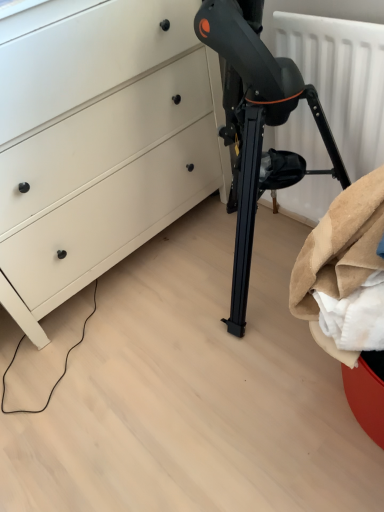
Describe the element at coordinates (100, 145) in the screenshot. This screenshot has width=384, height=512. I see `white matte chest of drawers at lower left` at that location.

The height and width of the screenshot is (512, 384). In order to click on white matte chest of drawers at lower left in this screenshot , I will do click(100, 145).

Where is `white matte radiator at upper right`? white matte radiator at upper right is located at coordinates (341, 79).

What do you see at coordinates (341, 79) in the screenshot? The height and width of the screenshot is (512, 384). I see `white matte radiator at upper right` at bounding box center [341, 79].

Locate an element on the screen. white matte chest of drawers at lower left is located at coordinates (x=100, y=145).

Considering the positions of objects white matte radiator at upper right and white matte chest of drawers at lower left in the image provided, who is more to the right, white matte radiator at upper right or white matte chest of drawers at lower left?

white matte radiator at upper right.

Is white matte radiator at upper right further to camera compared to white matte chest of drawers at lower left?

Yes, white matte radiator at upper right is further from the camera.

Which is closer to the camera, (374, 126) or (22, 212)?

The point (374, 126) is more forward.

From the image's perspective, which is below, white matte radiator at upper right or white matte chest of drawers at lower left?

white matte radiator at upper right, from the image's perspective.

From a real-world perspective, is white matte radiator at upper right above or below white matte chest of drawers at lower left?

white matte radiator at upper right is situated lower than white matte chest of drawers at lower left in the real world.

From the picture: Does white matte radiator at upper right have a greater width compared to white matte chest of drawers at lower left?

No.

Does white matte radiator at upper right have a greater height compared to white matte chest of drawers at lower left?

Incorrect, the height of white matte radiator at upper right is not larger of that of white matte chest of drawers at lower left.

Does white matte radiator at upper right have a larger size compared to white matte chest of drawers at lower left?

Actually, white matte radiator at upper right might be smaller than white matte chest of drawers at lower left.

Can white matte chest of drawers at lower left be found inside white matte radiator at upper right?

No, white matte radiator at upper right does not contain white matte chest of drawers at lower left.

Are white matte radiator at upper right and white matte chest of drawers at lower left making contact?

white matte radiator at upper right is not next to white matte chest of drawers at lower left, and they're not touching.

Does white matte radiator at upper right turn towards white matte chest of drawers at lower left?

No, white matte radiator at upper right is not aimed at white matte chest of drawers at lower left.

Consider the image. Can you tell me how much white matte radiator at upper right and white matte chest of drawers at lower left differ in facing direction?

89.2 degrees separate the facing orientations of white matte radiator at upper right and white matte chest of drawers at lower left.

At what (x,y) coordinates should I click in order to perform the action: click on radiator below the white matte chest of drawers at lower left (from the image's perspective). Please return your answer as a coordinate pair (x, y). The width and height of the screenshot is (384, 512). Looking at the image, I should click on (341, 79).

Considering the positions of objects white matte chest of drawers at lower left and white matte radiator at upper right in the image provided, who is more to the right, white matte chest of drawers at lower left or white matte radiator at upper right?

white matte radiator at upper right.

Which object is more forward, white matte chest of drawers at lower left or white matte radiator at upper right?

white matte chest of drawers at lower left is more forward.

Which is behind, point (119, 144) or point (332, 180)?

The point (332, 180) is more distant.

From the image's perspective, is white matte chest of drawers at lower left positioned above or below white matte radiator at upper right?

Based on their image positions, white matte chest of drawers at lower left is located above white matte radiator at upper right.

From a real-world perspective, is white matte chest of drawers at lower left located higher than white matte radiator at upper right?

Correct, in the physical world, white matte chest of drawers at lower left is higher than white matte radiator at upper right.

Is white matte chest of drawers at lower left wider or thinner than white matte radiator at upper right?

white matte chest of drawers at lower left is wider than white matte radiator at upper right.

Considering the sizes of white matte chest of drawers at lower left and white matte radiator at upper right in the image, is white matte chest of drawers at lower left taller or shorter than white matte radiator at upper right?

Considering their sizes, white matte chest of drawers at lower left has more height than white matte radiator at upper right.

Who is smaller, white matte chest of drawers at lower left or white matte radiator at upper right?

Smaller between the two is white matte radiator at upper right.

Is white matte chest of drawers at lower left positioned beyond the bounds of white matte radiator at upper right?

white matte chest of drawers at lower left lies outside white matte radiator at upper right's area.

Is white matte chest of drawers at lower left touching white matte radiator at upper right?

No, white matte chest of drawers at lower left is not touching white matte radiator at upper right.

Is white matte chest of drawers at lower left oriented away from white matte radiator at upper right?

white matte chest of drawers at lower left is not turned away from white matte radiator at upper right.

Can you tell me how much white matte chest of drawers at lower left and white matte radiator at upper right differ in facing direction?

They differ by 89.2 degrees in their facing directions.

How much distance is there between white matte chest of drawers at lower left and white matte radiator at upper right?

A distance of 19.75 inches exists between white matte chest of drawers at lower left and white matte radiator at upper right.

The image size is (384, 512). Find the location of `chest of drawers on the left of white matte radiator at upper right`. chest of drawers on the left of white matte radiator at upper right is located at coordinates (100, 145).

Find the location of a particular element. This screenshot has height=512, width=384. chest of drawers in front of the white matte radiator at upper right is located at coordinates (100, 145).

You are a GUI agent. You are given a task and a screenshot of the screen. Output one action in this format:
    pyautogui.click(x=<x>, y=<y>)
    Task: Click on the chest of drawers on the left of white matte radiator at upper right
    This screenshot has width=384, height=512.
    Given the screenshot: What is the action you would take?
    pyautogui.click(x=100, y=145)